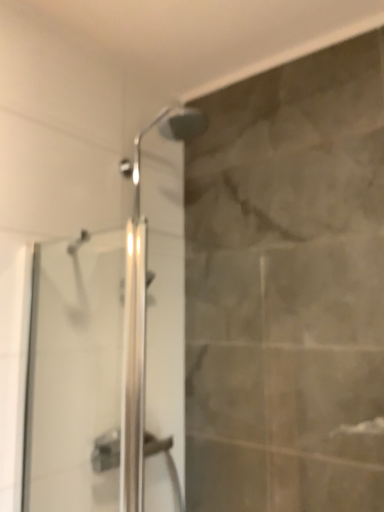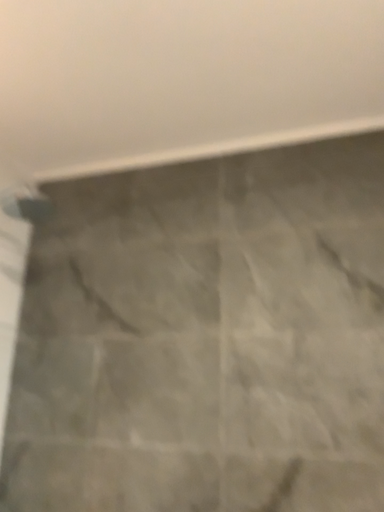
Question: How did the camera likely rotate when shooting the video?

Choices:
 (A) rotated left
 (B) rotated right

Answer: (B)